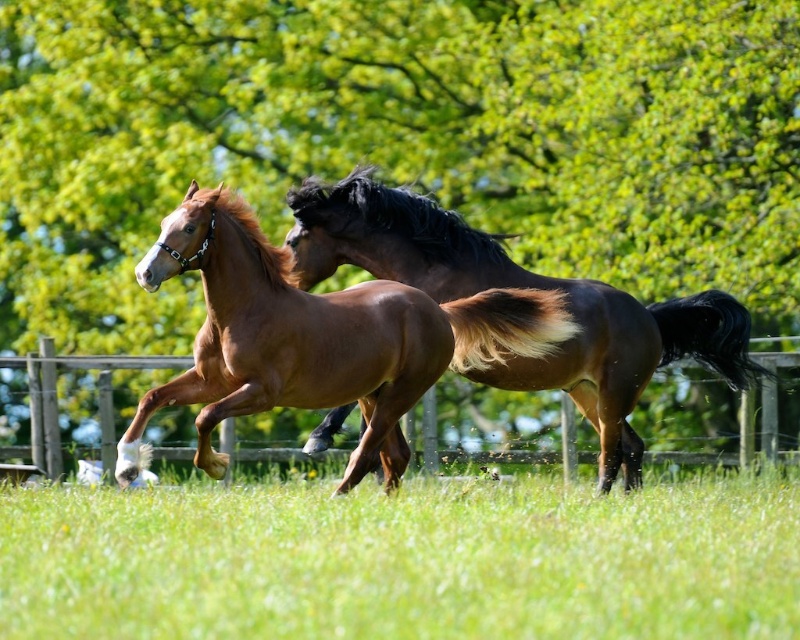
You are a photographer trying to capture a photo of the two horses. You want to position yourself so that the green grass at center and the wooden fence at center are both visible in the frame. Which object should be placed to the left in your composition?

The wooden fence at center should be placed to the left in your composition because the green grass at center is positioned on the right side of it.

You are a photographer trying to capture the shiny brown horse at center while ensuring the green leafy tree at upper center is visible in the background. Given their sizes, which object will occupy more space in your photo?

The green leafy tree at upper center will occupy more space in the photo because it is bigger than the shiny brown horse at center.

You are a photographer positioned in the field and want to capture a clear photo of the shiny brown horse at center without the green grass at center obstructing it. How should you adjust your camera angle?

To avoid the green grass at center obstructing the shiny brown horse at center, you should tilt your camera upwards since the green grass at center is closer to the viewer and the shiny brown horse at center is further away.